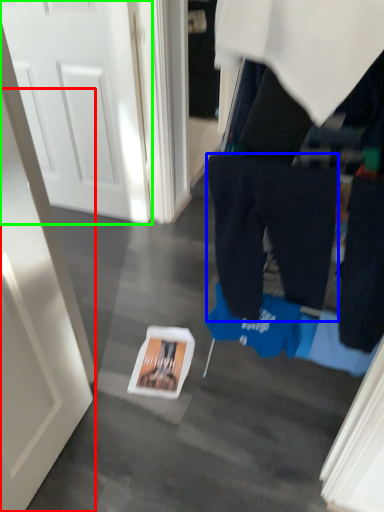
Question: Estimate the real-world distances between objects in this image. Which object is farther from door (highlighted by a red box), trousers (highlighted by a blue box) or door (highlighted by a green box)?

Choices:
 (A) trousers
 (B) door

Answer: (B)